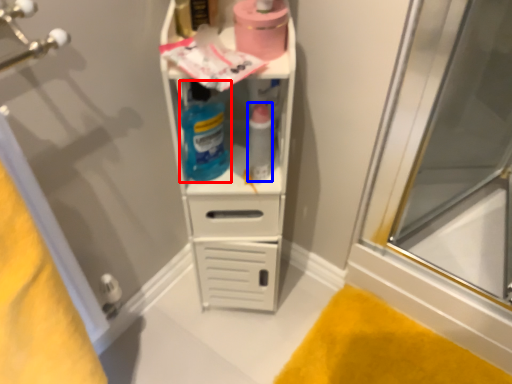
Question: Which point is closer to the camera, cleaning product (highlighted by a red box) or bottle (highlighted by a blue box)?

Choices:
 (A) cleaning product
 (B) bottle

Answer: (A)